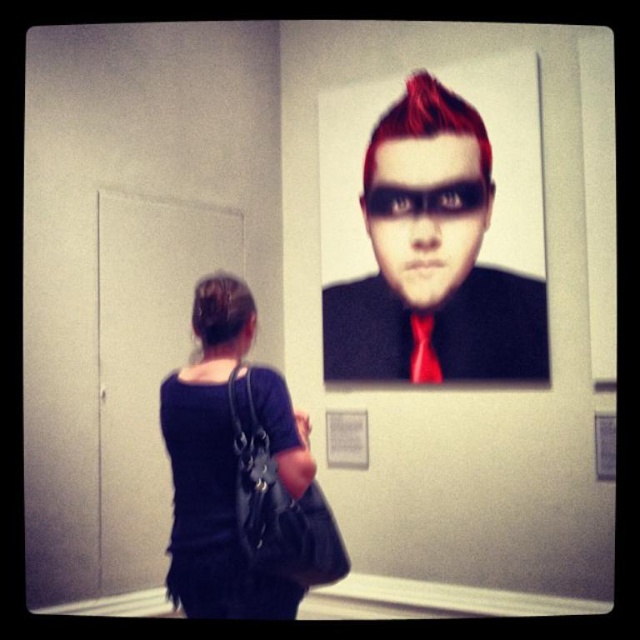
You are an art curator standing in front of the large portrait. You need to place a small decorative item between the matte black mask at upper center and the black shiny hair at upper center. The item is 10 inches long. Will there be enough space between them to fit the item?

The matte black mask at upper center and the black shiny hair at upper center are 30.70 inches apart from each other. Since the item is only 10 inches long, there is sufficient space to place it between them.

You are an art student analyzing the portrait in the gallery. The portrait has two elements at the upper center. Which one is larger between the matte black mask at upper center and the red satin tie at upper center?

The matte black mask at upper center is bigger than the red satin tie at upper center.